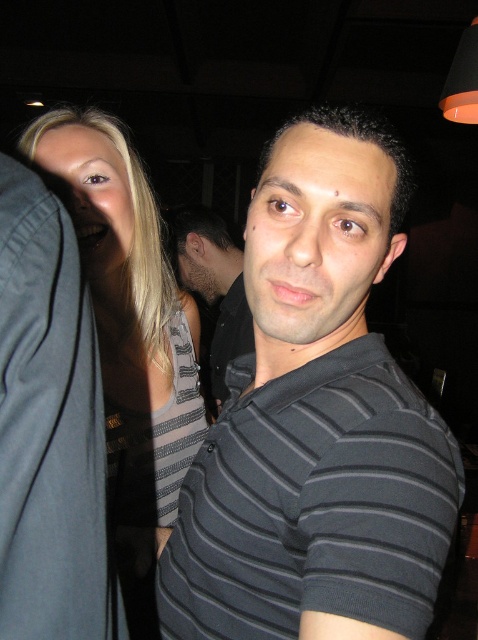
You are at a party and want to find the taller person between the dark gray striped polo shirt at center and the black striped shirt at center. Which one should you look for?

The black striped shirt at center is taller than the dark gray striped polo shirt at center, so you should look for the black striped shirt at center.

In the scene shown: You are standing in the social setting and want to move closer to the person on the right wearing a dark gray polo shirt with horizontal stripes. Which point, point 1 at coordinates (228, 484) or point 2 at coordinates (215, 285), is closer to the person you want to approach?

Point 1 at coordinates (228, 484) is closer to the person on the right wearing a dark gray polo shirt with horizontal stripes because it is closer to the viewer than point 2 at coordinates (215, 285).

You are at a party and want to take a photo of the blonde hair at left and the black striped shirt at center. Which one should you adjust your camera angle to capture both in the frame?

The blonde hair at left is much taller than the black striped shirt at center, so you should adjust your camera angle to look upwards to include the taller blonde hair at left and the shorter black striped shirt at center in the frame.